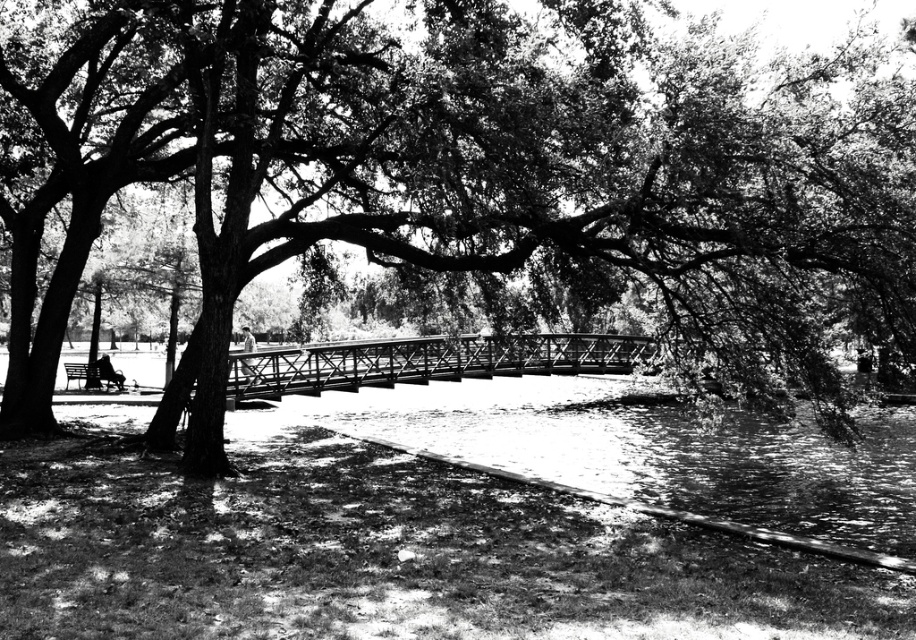
Question: Estimate the real-world distances between objects in this image. Which object is closer to the smooth bark tree at center?

Choices:
 (A) wooden bench at lower left
 (B) metallic bridge at center

Answer: (B)

Question: Does smooth bark tree at center have a smaller size compared to wooden bench at lower left?

Choices:
 (A) no
 (B) yes

Answer: (A)

Question: Does metallic bridge at center appear on the left side of wooden bench at lower left?

Choices:
 (A) no
 (B) yes

Answer: (A)

Question: Which point is farther from the camera taking this photo?

Choices:
 (A) (592, 339)
 (B) (85, 364)

Answer: (A)

Question: Where is metallic bridge at center located in relation to wooden bench at lower left in the image?

Choices:
 (A) left
 (B) right

Answer: (B)

Question: Which object is closer to the camera taking this photo?

Choices:
 (A) wooden bench at lower left
 (B) metallic bridge at center

Answer: (B)